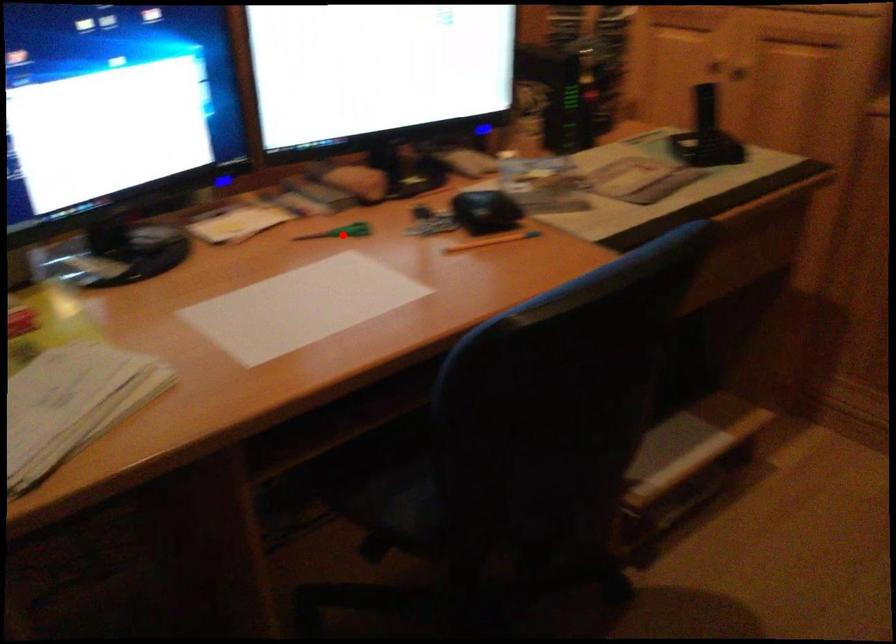
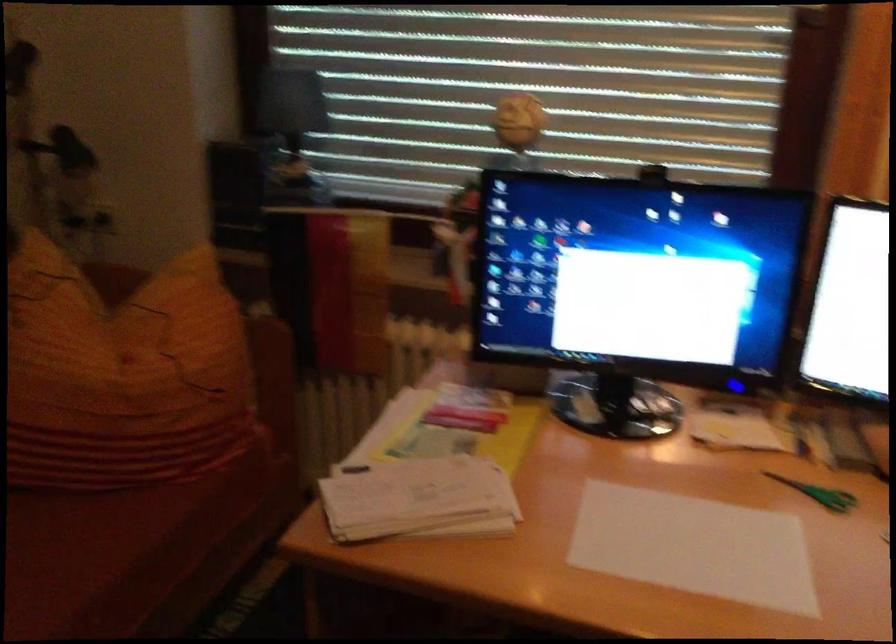
Locate, in the second image, the point that corresponds to the highlighted location in the first image.

(819, 493)